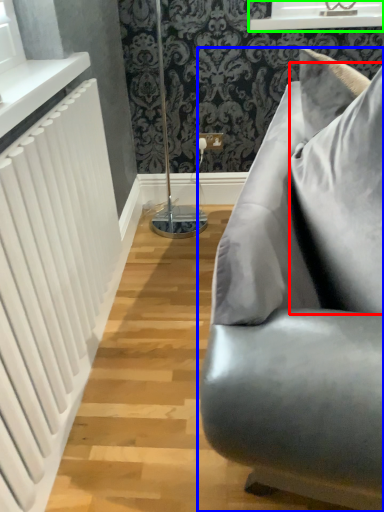
Question: Which is farther away from pillow (highlighted by a red box)? studio couch (highlighted by a blue box) or window frame (highlighted by a green box)?

Choices:
 (A) studio couch
 (B) window frame

Answer: (B)